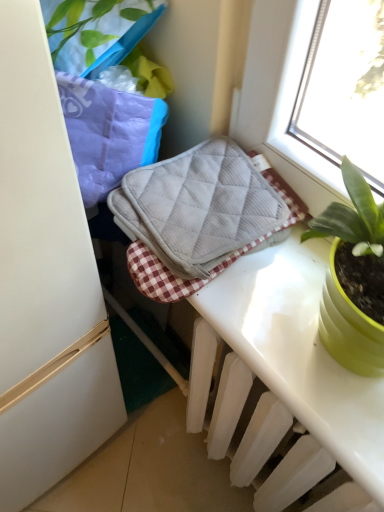
This screenshot has height=512, width=384. What are the coordinates of `vacant space situated above gray quilted oven mitt at center (from a real-world perspective)` in the screenshot? It's located at (225, 194).